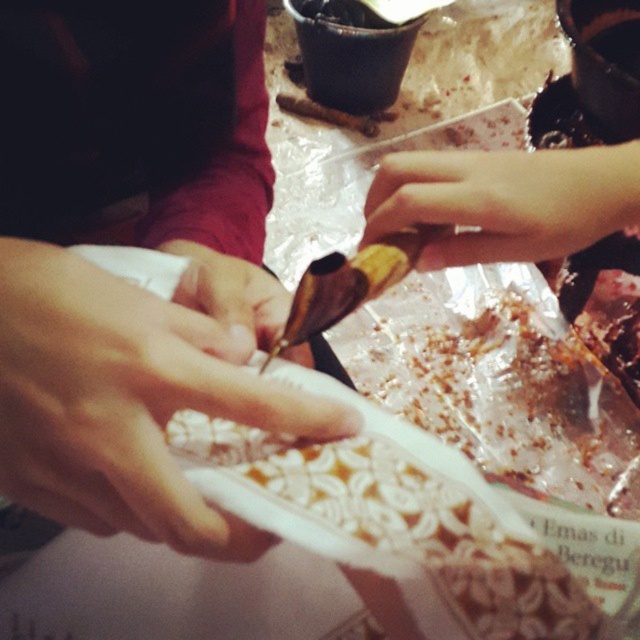
Is white matte plate at center positioned before smooth skin at center?

Yes.

Is point (252, 557) more distant than point (301, 352)?

That is False.

The width and height of the screenshot is (640, 640). I want to click on white matte plate at center, so click(134, 390).

Is white matte plate at center to the right of pale skin at upper right from the viewer's perspective?

In fact, white matte plate at center is to the left of pale skin at upper right.

Who is more distant from viewer, [40,387] or [472,150]?

The point [472,150] is more distant.

Locate an element on the screen. Image resolution: width=640 pixels, height=640 pixels. white matte plate at center is located at coordinates (134, 390).

The width and height of the screenshot is (640, 640). I want to click on white matte plate at center, so 134,390.

Can you confirm if pale skin at upper right is smaller than smooth skin at center?

No.

Is the position of pale skin at upper right less distant than that of smooth skin at center?

That is True.

This screenshot has width=640, height=640. What do you see at coordinates (506, 202) in the screenshot? I see `pale skin at upper right` at bounding box center [506, 202].

The width and height of the screenshot is (640, 640). What are the coordinates of `pale skin at upper right` in the screenshot? It's located at (506, 202).